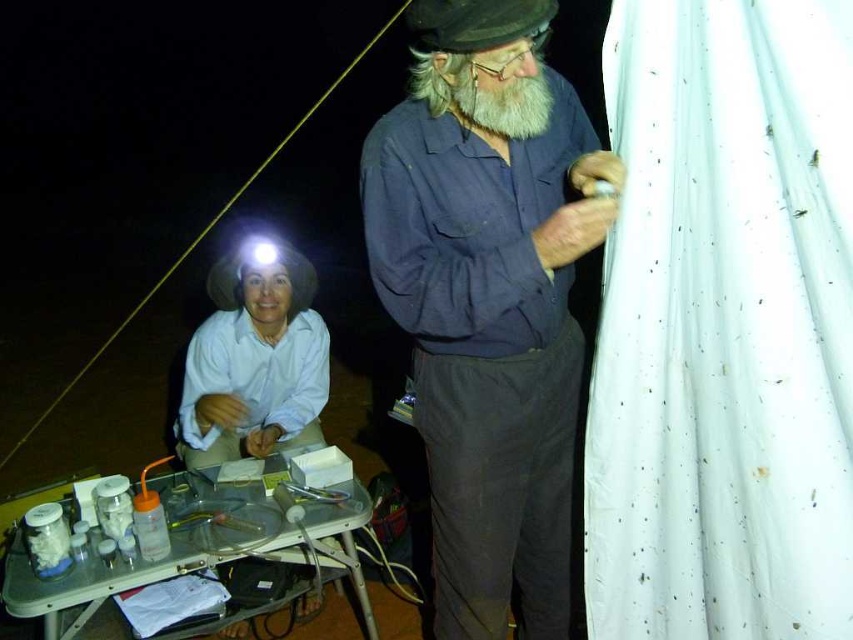
Question: Is blue cotton shirt at center below white matte hat at upper left?

Choices:
 (A) yes
 (B) no

Answer: (A)

Question: Does blue cotton shirt at center appear on the right side of white matte hat at upper left?

Choices:
 (A) no
 (B) yes

Answer: (B)

Question: Observing the image, what is the correct spatial positioning of blue cotton shirt at center in reference to white matte hat at upper left?

Choices:
 (A) below
 (B) above

Answer: (A)